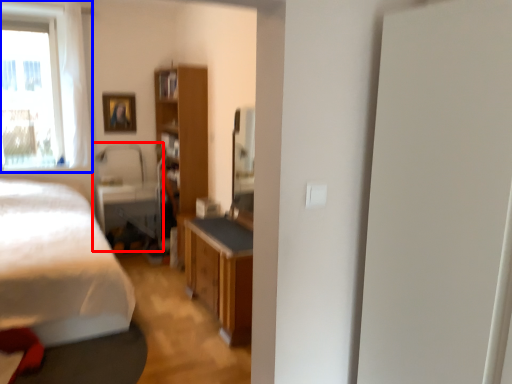
Question: Which point is further to the camera, swivel chair (highlighted by a red box) or window (highlighted by a blue box)?

Choices:
 (A) swivel chair
 (B) window

Answer: (A)